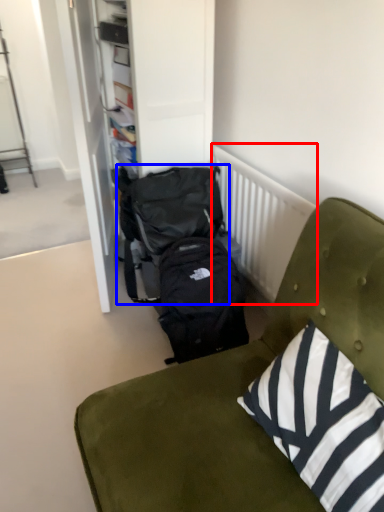
Question: Which of the following is the closest to the observer, radiator (highlighted by a red box) or backpack (highlighted by a blue box)?

Choices:
 (A) radiator
 (B) backpack

Answer: (A)